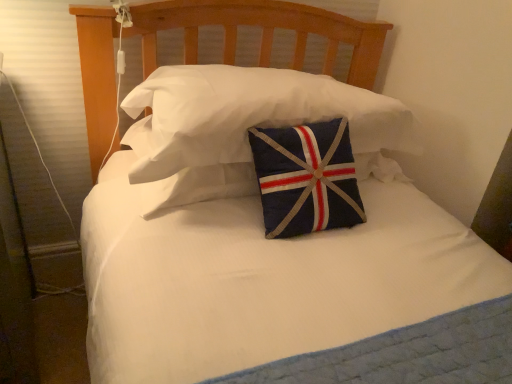
Question: From a real-world perspective, relative to quilted fabric pillow at center, marked as the 1th pillow in a top-to-bottom arrangement, is navy blue fabric pillow at center, which is the second pillow from top to bottom, vertically above or below?

Choices:
 (A) below
 (B) above

Answer: (A)

Question: Is navy blue fabric pillow at center, which is the second pillow from top to bottom, in front of or behind quilted fabric pillow at center, which is the second pillow from bottom to top, in the image?

Choices:
 (A) front
 (B) behind

Answer: (B)

Question: Looking at their shapes, would you say navy blue fabric pillow at center, the 1th pillow from the bottom, is wider or thinner than quilted fabric pillow at center, marked as the 1th pillow in a top-to-bottom arrangement?

Choices:
 (A) thin
 (B) wide

Answer: (B)

Question: From their relative heights in the image, would you say quilted fabric pillow at center, which is the second pillow from bottom to top, is taller or shorter than navy blue fabric pillow at center, which is the second pillow from top to bottom?

Choices:
 (A) tall
 (B) short

Answer: (A)

Question: Considering the positions of point (209, 97) and point (238, 187), is point (209, 97) closer or farther from the camera than point (238, 187)?

Choices:
 (A) farther
 (B) closer

Answer: (B)

Question: In terms of size, does quilted fabric pillow at center, marked as the 1th pillow in a top-to-bottom arrangement, appear bigger or smaller than navy blue fabric pillow at center, which is the second pillow from top to bottom?

Choices:
 (A) small
 (B) big

Answer: (B)

Question: From the image's perspective, is quilted fabric pillow at center, which is the second pillow from bottom to top, located above or below navy blue fabric pillow at center, the 1th pillow from the bottom?

Choices:
 (A) below
 (B) above

Answer: (B)